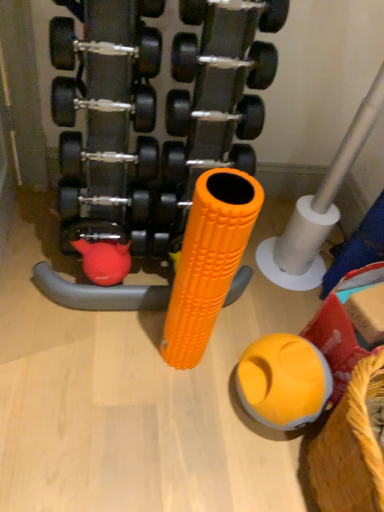
Where is `vacant space in front of rubberized yellow ball at lower right`? Image resolution: width=384 pixels, height=512 pixels. vacant space in front of rubberized yellow ball at lower right is located at coordinates (253, 469).